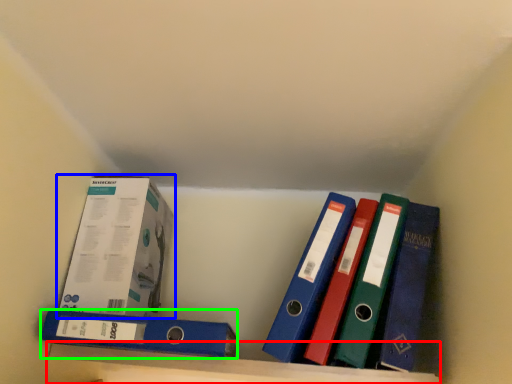
Question: Which is nearer to the shelf (highlighted by a red box)? box (highlighted by a blue box) or binder (highlighted by a green box).

Choices:
 (A) box
 (B) binder

Answer: (B)